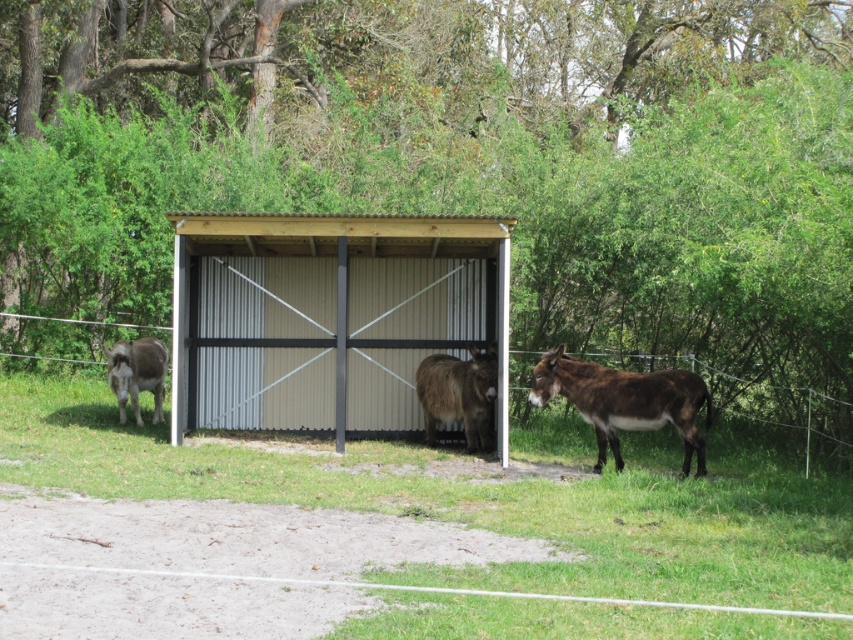
Question: Which object appears closest to the camera in this image?

Choices:
 (A) metallic corrugated barn at center
 (B) brown fuzzy mule at center
 (C) brown fuzzy donkey at left

Answer: (B)

Question: Which object appears closest to the camera in this image?

Choices:
 (A) brown fuzzy donkey at left
 (B) brown fuzzy mule at center
 (C) metal wire fence at center

Answer: (C)

Question: Can you confirm if green grass at center is bigger than metal wire fence at center?

Choices:
 (A) yes
 (B) no

Answer: (B)

Question: Observing the image, what is the correct spatial positioning of brown fuzzy mule at right in reference to brown fuzzy donkey at left?

Choices:
 (A) above
 (B) below

Answer: (B)

Question: Which of the following is the farthest from the observer?

Choices:
 (A) (433, 387)
 (B) (119, 346)

Answer: (B)

Question: Does brown fuzzy mule at right come in front of brown fuzzy donkey at left?

Choices:
 (A) yes
 (B) no

Answer: (A)